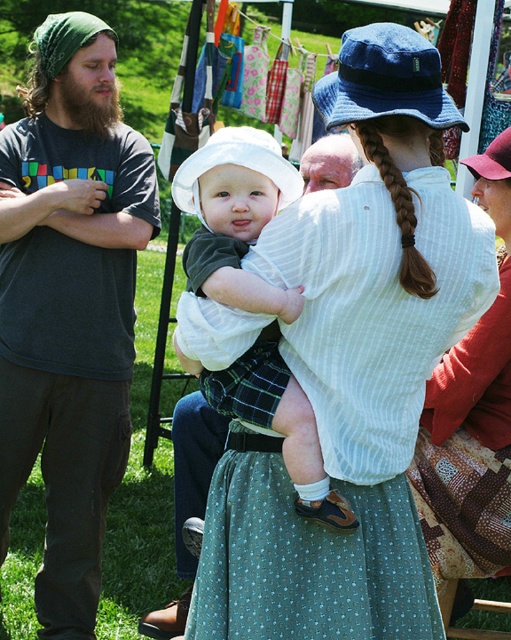
Question: Where is green dotted fabric dress at center located in relation to dark gray t-shirt at left in the image?

Choices:
 (A) left
 (B) right

Answer: (B)

Question: Is dark gray t-shirt at left positioned in front of green plaid shorts at center?

Choices:
 (A) yes
 (B) no

Answer: (B)

Question: Which of the following is the closest to the observer?

Choices:
 (A) white striped shirt at center
 (B) green plaid shorts at center
 (C) dark gray t-shirt at left

Answer: (B)

Question: Which of these objects is positioned farthest from the dark gray t-shirt at left?

Choices:
 (A) gray hair at center
 (B) white striped shirt at center
 (C) green plaid shorts at center

Answer: (B)

Question: In this image, where is white striped shirt at center located relative to green plaid shorts at center?

Choices:
 (A) below
 (B) above

Answer: (A)

Question: Among these objects, which one is nearest to the camera?

Choices:
 (A) dark gray t-shirt at left
 (B) green plaid shorts at center
 (C) white striped shirt at center

Answer: (B)